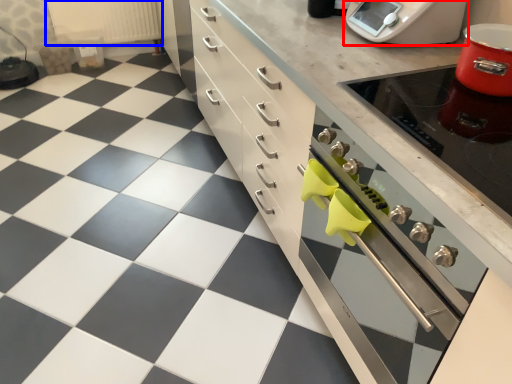
Question: Which object is further to the camera taking this photo, home appliance (highlighted by a red box) or radiator (highlighted by a blue box)?

Choices:
 (A) home appliance
 (B) radiator

Answer: (B)